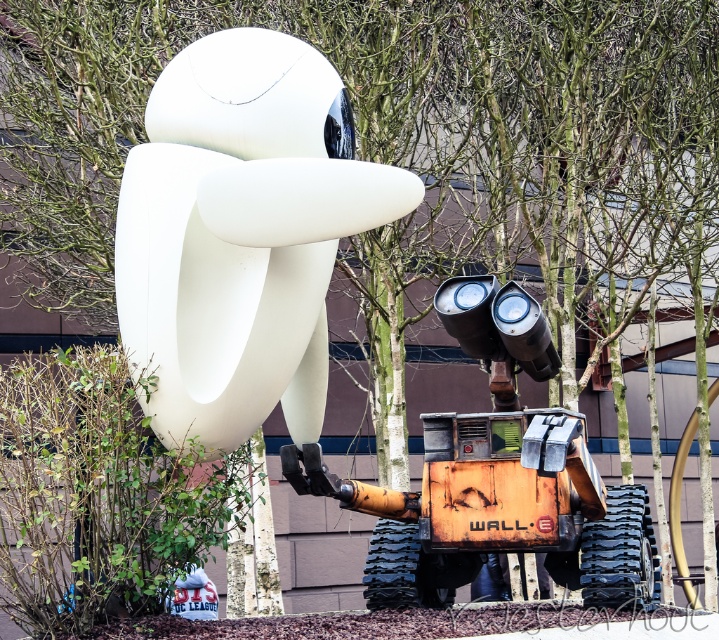
Question: Can you confirm if white matte sculpture at center is wider than orange metallic excavator at center?

Choices:
 (A) no
 (B) yes

Answer: (A)

Question: Is white matte sculpture at center wider than orange metallic excavator at center?

Choices:
 (A) no
 (B) yes

Answer: (A)

Question: Is white matte sculpture at center in front of orange metallic excavator at center?

Choices:
 (A) yes
 (B) no

Answer: (A)

Question: Among these points, which one is farthest from the camera?

Choices:
 (A) (582, 589)
 (B) (219, 278)

Answer: (A)